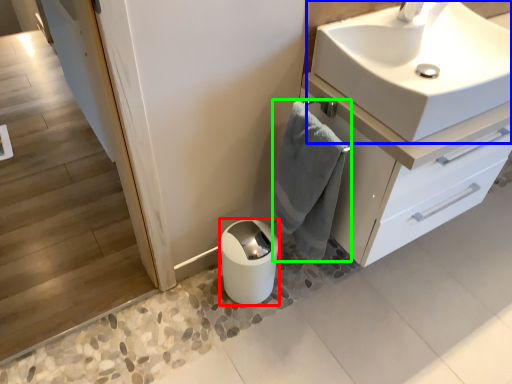
Question: Based on their relative distances, which object is farther from toilet paper (highlighted by a red box)? Choose from sink (highlighted by a blue box) and bath towel (highlighted by a green box).

Choices:
 (A) sink
 (B) bath towel

Answer: (A)